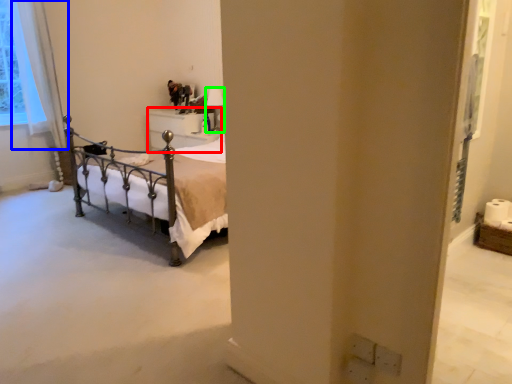
Question: Which object is positioned farthest from furniture (highlighted by a red box)? Select from curtain (highlighted by a blue box) and lamp (highlighted by a green box).

Choices:
 (A) curtain
 (B) lamp

Answer: (A)